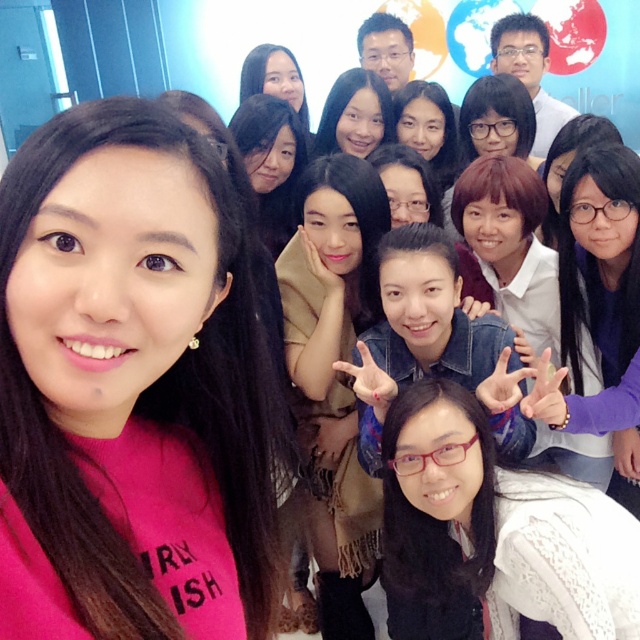
Does clear plastic glasses at center appear over purple matte sweater at lower right?

Incorrect, clear plastic glasses at center is not positioned above purple matte sweater at lower right.

Does clear plastic glasses at center appear under purple matte sweater at lower right?

Yes, clear plastic glasses at center is below purple matte sweater at lower right.

Is point (637, 529) positioned after point (625, 500)?

No.

At what (x,y) coordinates should I click in order to perform the action: click on clear plastic glasses at center. Please return your answer as a coordinate pair (x, y). The height and width of the screenshot is (640, 640). Looking at the image, I should click on (499, 524).

Between clear plastic glasses at center and matte black hair at center, which one has more height?

clear plastic glasses at center

Is point (611, 540) behind point (372, 90)?

No.

Where is `clear plastic glasses at center`? This screenshot has width=640, height=640. clear plastic glasses at center is located at coordinates (499, 524).

This screenshot has height=640, width=640. Find the location of `clear plastic glasses at center`. clear plastic glasses at center is located at coordinates (499, 524).

Which is below, tan scarf at center or purple matte sweater at lower right?

tan scarf at center

Does tan scarf at center have a smaller size compared to purple matte sweater at lower right?

Yes, tan scarf at center is smaller than purple matte sweater at lower right.

What do you see at coordinates (333, 372) in the screenshot?
I see `tan scarf at center` at bounding box center [333, 372].

Locate an element on the screen. This screenshot has height=640, width=640. tan scarf at center is located at coordinates (333, 372).